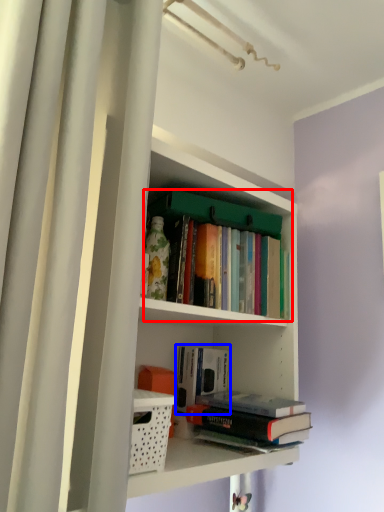
Question: Which object is closer to the camera taking this photo, book (highlighted by a red box) or book (highlighted by a blue box)?

Choices:
 (A) book
 (B) book

Answer: (A)